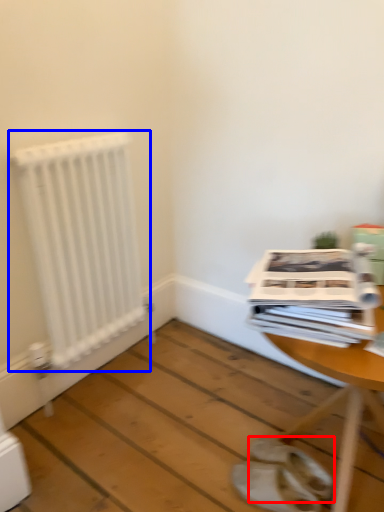
Question: Which point is closer to the camera, footwear (highlighted by a red box) or radiator (highlighted by a blue box)?

Choices:
 (A) footwear
 (B) radiator

Answer: (A)